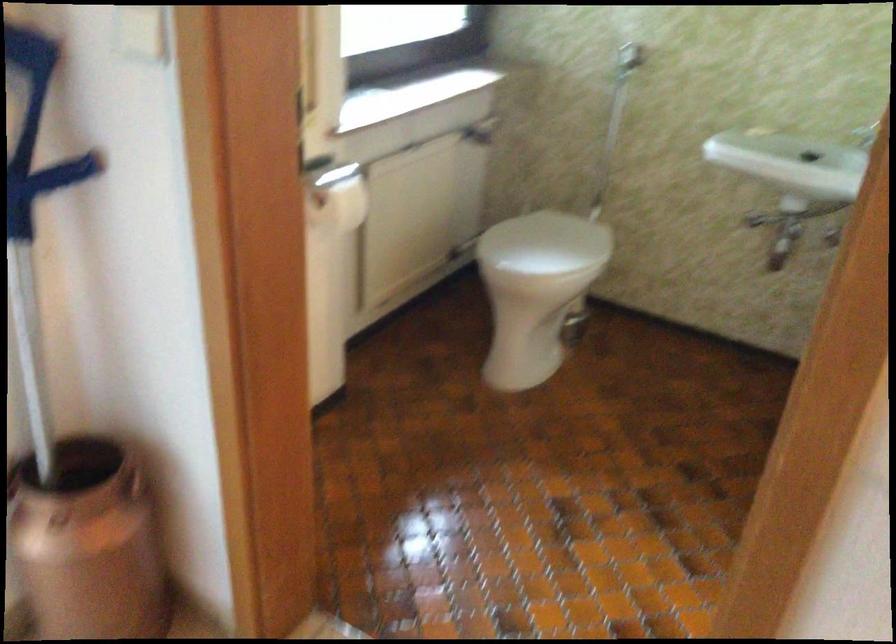
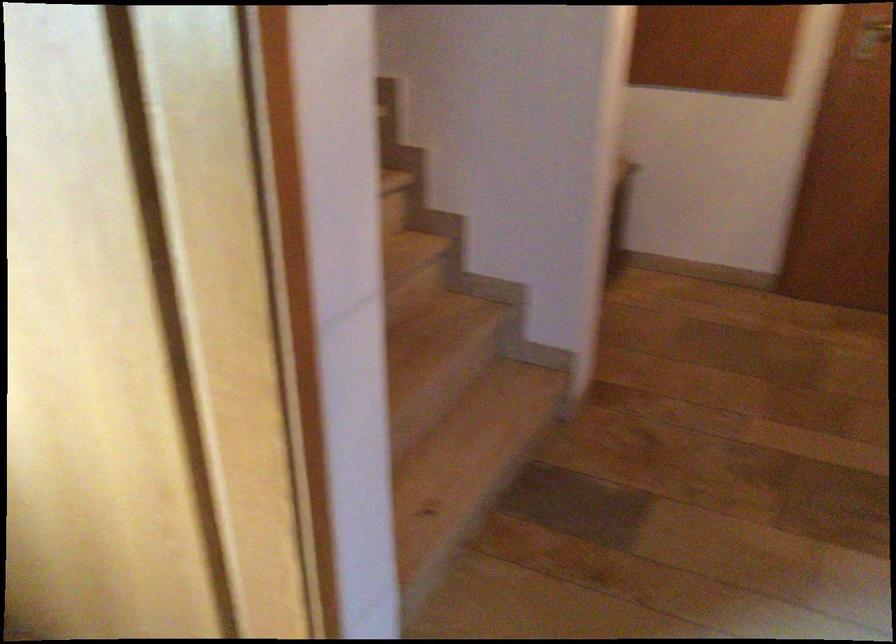
First-person continuous shooting, in which direction is the camera rotating?

The camera rotated toward right-down.